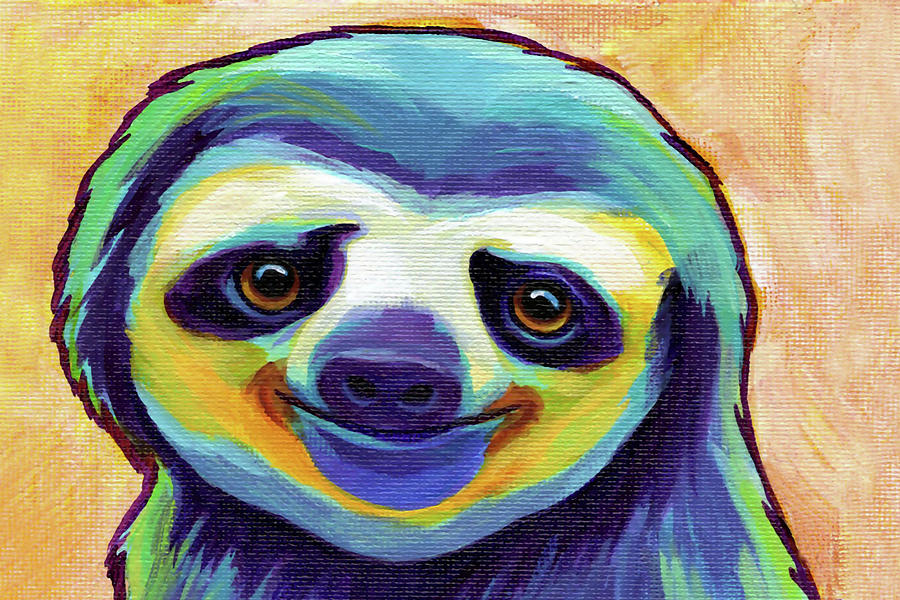
Where is `lime green trim`? This screenshot has width=900, height=600. lime green trim is located at coordinates (772, 536), (682, 165), (136, 539), (73, 355), (92, 219).